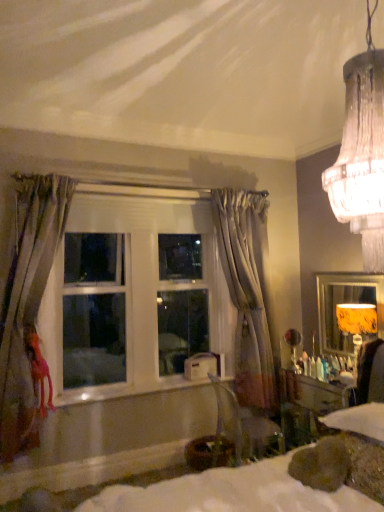
Question: From the image's perspective, would you say silky gray curtain at center, positioned as the first curtain in right-to-left order, is positioned over white fabric bed at lower center?

Choices:
 (A) yes
 (B) no

Answer: (A)

Question: Is silky gray curtain at center, positioned as the first curtain in right-to-left order, completely or partially outside of white fabric bed at lower center?

Choices:
 (A) no
 (B) yes

Answer: (B)

Question: From a real-world perspective, is silky gray curtain at center, arranged as the 1th curtain when viewed from the back, positioned over white fabric bed at lower center based on gravity?

Choices:
 (A) no
 (B) yes

Answer: (B)

Question: Can you confirm if silky gray curtain at center, positioned as the first curtain in right-to-left order, is bigger than white fabric bed at lower center?

Choices:
 (A) no
 (B) yes

Answer: (A)

Question: Is silky gray curtain at center, which appears as the second curtain when viewed from the front, closer to camera compared to white fabric bed at lower center?

Choices:
 (A) no
 (B) yes

Answer: (A)

Question: Can you confirm if silky gray curtain at center, which appears as the second curtain when viewed from the front, is positioned to the left of white fabric bed at lower center?

Choices:
 (A) no
 (B) yes

Answer: (B)

Question: Considering the relative positions of velvet gray armchair at lower right and yellow fabric lampshade at right in the image provided, is velvet gray armchair at lower right behind yellow fabric lampshade at right?

Choices:
 (A) no
 (B) yes

Answer: (A)

Question: From the image's perspective, is velvet gray armchair at lower right below yellow fabric lampshade at right?

Choices:
 (A) yes
 (B) no

Answer: (A)

Question: Is yellow fabric lampshade at right a part of velvet gray armchair at lower right?

Choices:
 (A) yes
 (B) no

Answer: (B)

Question: Does velvet gray armchair at lower right come in front of yellow fabric lampshade at right?

Choices:
 (A) yes
 (B) no

Answer: (A)

Question: From a real-world perspective, is velvet gray armchair at lower right positioned over yellow fabric lampshade at right based on gravity?

Choices:
 (A) yes
 (B) no

Answer: (B)

Question: Considering the relative positions of velvet gray armchair at lower right and yellow fabric lampshade at right in the image provided, is velvet gray armchair at lower right to the right of yellow fabric lampshade at right from the viewer's perspective?

Choices:
 (A) yes
 (B) no

Answer: (B)

Question: Can you confirm if white glossy window sill at center is bigger than white fabric bed at lower center?

Choices:
 (A) no
 (B) yes

Answer: (A)